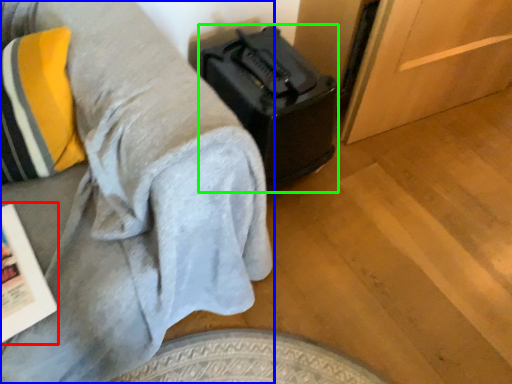
Question: Considering the real-world distances, which object is closest to magazine (highlighted by a red box)? furniture (highlighted by a blue box) or luggage (highlighted by a green box).

Choices:
 (A) furniture
 (B) luggage

Answer: (A)